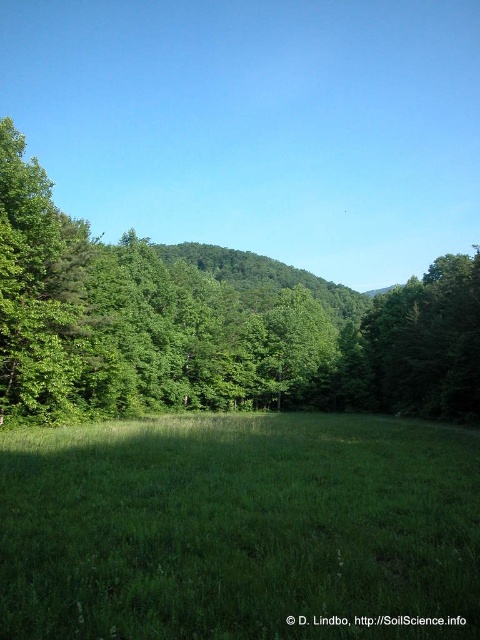
Can you confirm if green grassy field at center is taller than green leafy tree at right?

No.

Is green grassy field at center further to the viewer compared to green leafy tree at right?

No, green grassy field at center is in front of green leafy tree at right.

Who is more forward, (4,513) or (414,337)?

Point (4,513) is in front.

You are a GUI agent. You are given a task and a screenshot of the screen. Output one action in this format:
    pyautogui.click(x=<x>, y=<y>)
    Task: Click on the green grassy field at center
    
    Given the screenshot: What is the action you would take?
    pyautogui.click(x=239, y=529)

Is point (336, 312) farther from camera compared to point (406, 342)?

Yes.

This screenshot has height=640, width=480. What do you see at coordinates (212, 323) in the screenshot? I see `green leafy tree at center` at bounding box center [212, 323].

Is point (178, 326) more distant than point (393, 364)?

Yes, point (178, 326) is farther from viewer.

The height and width of the screenshot is (640, 480). I want to click on green leafy tree at center, so click(x=212, y=323).

Is green grassy field at center above green leafy tree at center?

No.

Does green grassy field at center have a larger size compared to green leafy tree at center?

Incorrect, green grassy field at center is not larger than green leafy tree at center.

The width and height of the screenshot is (480, 640). Find the location of `green grassy field at center`. green grassy field at center is located at coordinates (239, 529).

This screenshot has height=640, width=480. In order to click on green grassy field at center in this screenshot , I will do `click(239, 529)`.